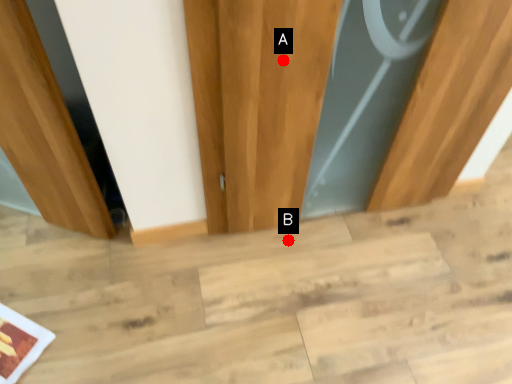
Question: Two points are circled on the image, labeled by A and B beside each circle. Which of the following is the closest to the observer?

Choices:
 (A) A is closer
 (B) B is closer

Answer: (A)